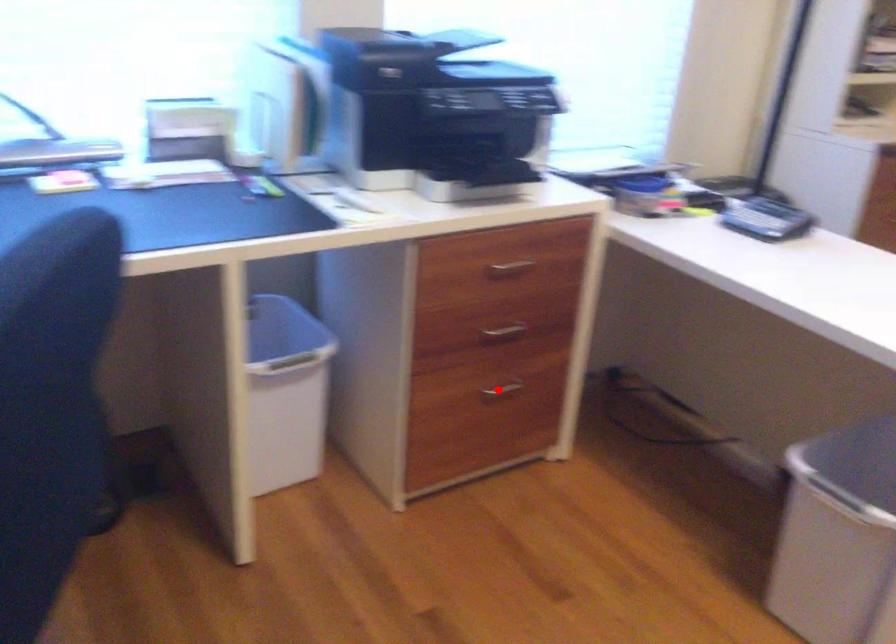
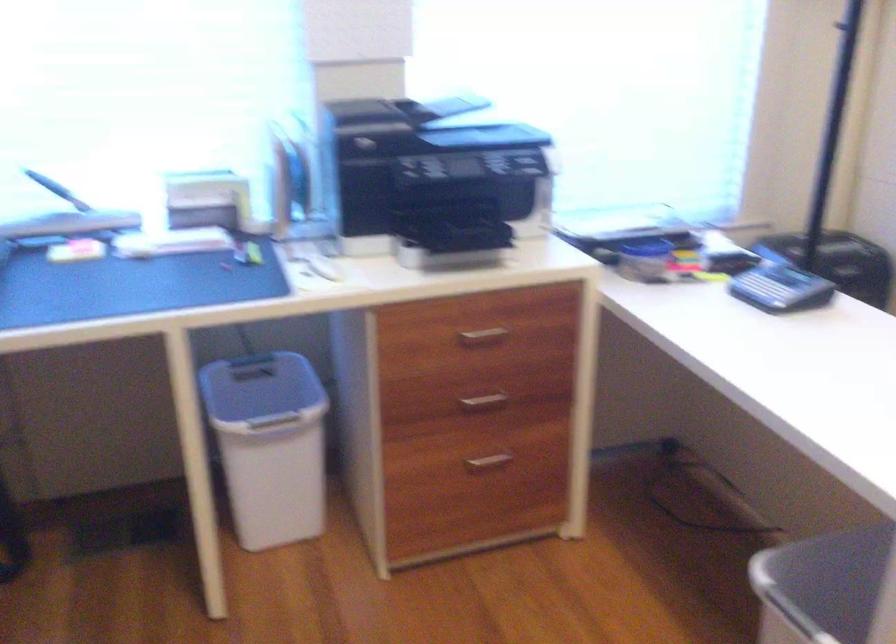
The point at the highlighted location is marked in the first image. Where is the corresponding point in the second image?

(487, 462)